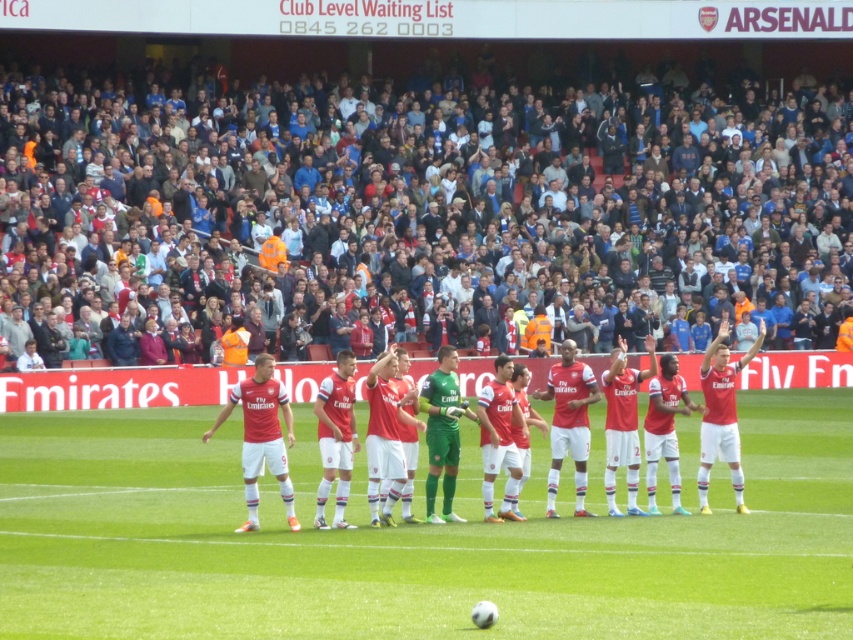
Question: Estimate the real-world distances between objects in this image. Which object is farther from the matte red jersey at center?

Choices:
 (A) green grass football field at center
 (B) multicolored fabric crowd at upper center
 (C) red matte jersey at center
 (D) white matte jersey at center

Answer: (B)

Question: Does multicolored fabric crowd at upper center lie behind red matte jersey at center?

Choices:
 (A) no
 (B) yes

Answer: (B)

Question: Among these objects, which one is nearest to the camera?

Choices:
 (A) matte red jersey at center
 (B) multicolored fabric crowd at upper center
 (C) red matte jersey at center

Answer: (C)

Question: Can you confirm if multicolored fabric crowd at upper center is bigger than green grass football field at center?

Choices:
 (A) no
 (B) yes

Answer: (B)

Question: Can you confirm if red matte jersey at center is positioned below white matte jersey at center?

Choices:
 (A) no
 (B) yes

Answer: (A)

Question: Which of these objects is positioned farthest from the green grass football field at center?

Choices:
 (A) multicolored fabric crowd at upper center
 (B) matte red jersey at center
 (C) white matte jersey at center
 (D) red matte jersey at center

Answer: (A)